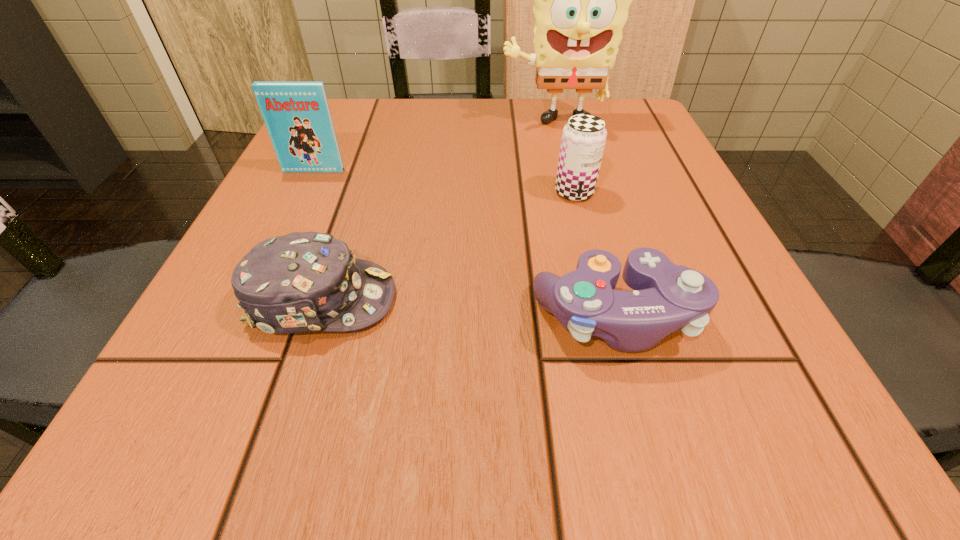
This screenshot has width=960, height=540. In order to click on free space between the third shortest object and the headwear in this screenshot , I will do click(448, 246).

Where is `unoccupied area between the headwear and the control`? unoccupied area between the headwear and the control is located at coordinates (468, 308).

Identify the location of object that is the third closest to the book. This screenshot has height=540, width=960. (583, 140).

Identify which object is located as the second nearest to the control. Please provide its 2D coordinates. Your answer should be formatted as a tuple, i.e. [(x, y)], where the tuple contains the x and y coordinates of a point satisfying the conditions above.

[(300, 282)]

The height and width of the screenshot is (540, 960). Identify the location of vacant point that satisfies the following two spatial constraints: 1. on the face of the tallest object; 2. on the front-facing side of the headwear. (596, 300).

Where is `free region that satisfies the following two spatial constraints: 1. on the front cover of the fourth nearest object; 2. on the right side of the third farthest object`? The image size is (960, 540). free region that satisfies the following two spatial constraints: 1. on the front cover of the fourth nearest object; 2. on the right side of the third farthest object is located at coordinates (303, 192).

At what (x,y) coordinates should I click in order to perform the action: click on free space that satisfies the following two spatial constraints: 1. on the face of the farthest object; 2. on the right side of the control. Please return your answer as a coordinate pair (x, y). Looking at the image, I should click on (601, 318).

Find the location of a particular element. free space that satisfies the following two spatial constraints: 1. on the front cover of the second tallest object; 2. on the left side of the control is located at coordinates (244, 318).

Where is `vacant position in the image that satisfies the following two spatial constraints: 1. on the front-facing side of the headwear; 2. on the left side of the control`? vacant position in the image that satisfies the following two spatial constraints: 1. on the front-facing side of the headwear; 2. on the left side of the control is located at coordinates (316, 318).

This screenshot has width=960, height=540. What are the coordinates of `vacant point that satisfies the following two spatial constraints: 1. on the face of the control; 2. on the right side of the tallest object` in the screenshot? It's located at (601, 318).